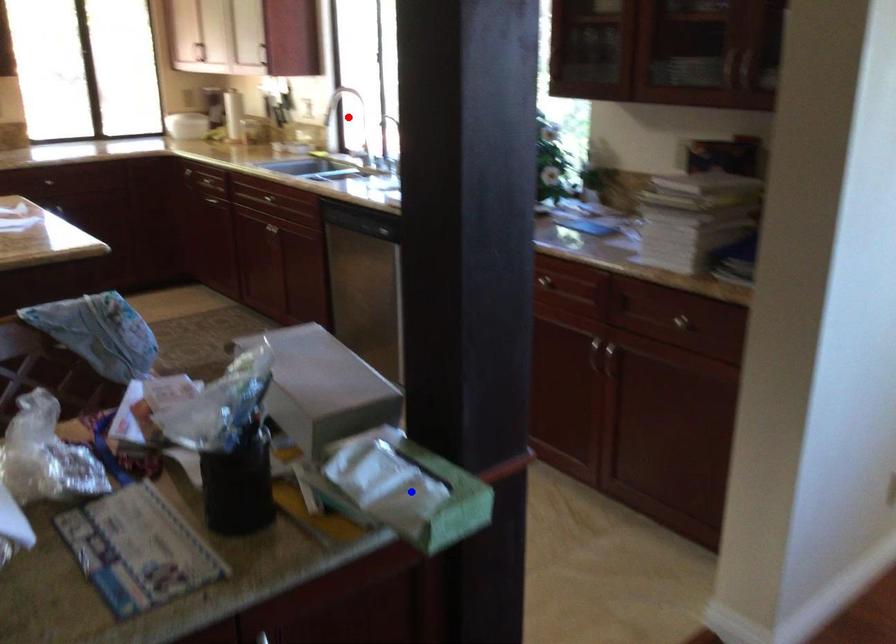
Question: Which of the two points in the image is closer to the camera?

Choices:
 (A) Blue point is closer.
 (B) Red point is closer.

Answer: (A)